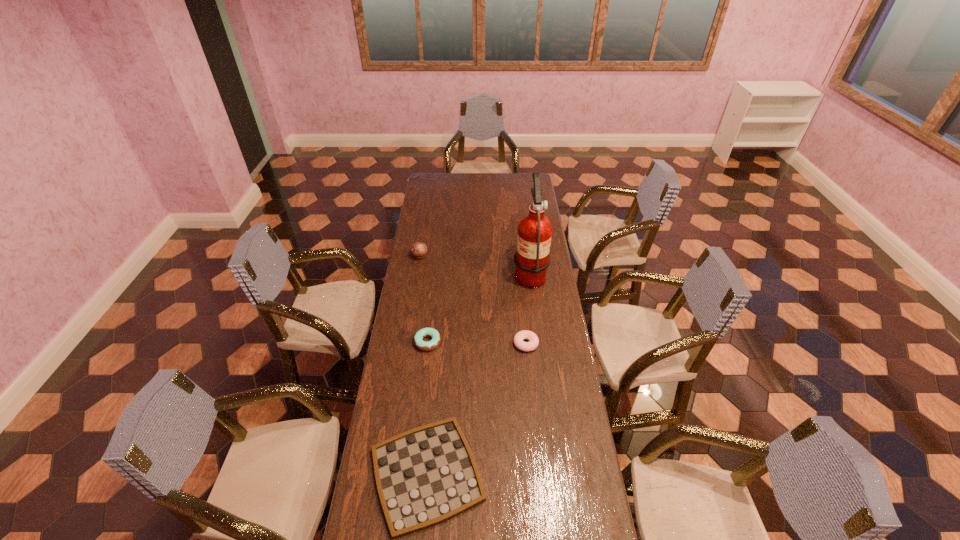
Where is `free space located 0.240m on the front of the left doughnut`? The image size is (960, 540). free space located 0.240m on the front of the left doughnut is located at coordinates (420, 403).

Where is `blank space located on the left of the right doughnut`? This screenshot has height=540, width=960. blank space located on the left of the right doughnut is located at coordinates (473, 343).

Image resolution: width=960 pixels, height=540 pixels. Identify the location of vacant area situated on the right of the shortest object. (570, 474).

I want to click on muffin present at the left edge, so click(x=419, y=250).

Where is `doughnut that is at the left edge`? doughnut that is at the left edge is located at coordinates 425,332.

Where is `checkerboard that is at the left edge`? checkerboard that is at the left edge is located at coordinates (425, 476).

Where is `fire extinguisher located at the right edge`? This screenshot has width=960, height=540. fire extinguisher located at the right edge is located at coordinates (532, 258).

Locate an element on the screen. The width and height of the screenshot is (960, 540). doughnut at the right edge is located at coordinates (518, 339).

At what (x,y) coordinates should I click in order to perform the action: click on vacant space at the left edge of the desktop. Please return your answer as a coordinate pair (x, y). Looking at the image, I should click on (408, 398).

Locate an element on the screen. The height and width of the screenshot is (540, 960). vacant space at the right edge of the desktop is located at coordinates (535, 331).